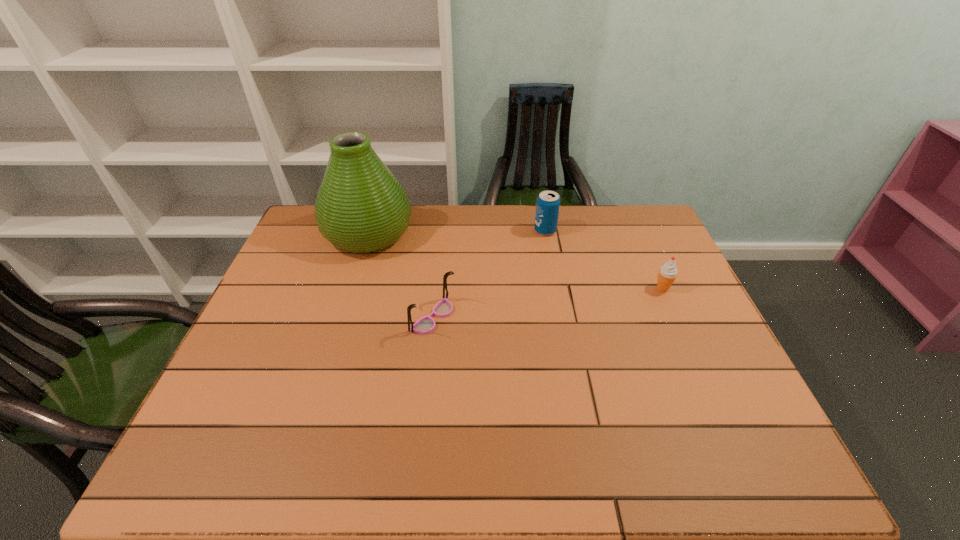
Locate an element on the screen. empty location between the tallest object and the soda can is located at coordinates (457, 232).

Where is `free space between the spectacles and the third object from left to right`? The width and height of the screenshot is (960, 540). free space between the spectacles and the third object from left to right is located at coordinates (489, 274).

Locate an element on the screen. The width and height of the screenshot is (960, 540). object that is the nearest to the nearest object is located at coordinates (361, 207).

Select which object is the second closest to the rightmost object. Please provide its 2D coordinates. Your answer should be formatted as a tuple, i.e. [(x, y)], where the tuple contains the x and y coordinates of a point satisfying the conditions above.

[(425, 325)]

Find the location of a particular element. vacant space that satisfies the following two spatial constraints: 1. on the front side of the leftmost object; 2. on the left side of the rightmost object is located at coordinates (351, 288).

Where is `free spot that satisfies the following two spatial constraints: 1. on the back side of the nearest object; 2. on the left side of the icecream`? free spot that satisfies the following two spatial constraints: 1. on the back side of the nearest object; 2. on the left side of the icecream is located at coordinates (436, 288).

You are a GUI agent. You are given a task and a screenshot of the screen. Output one action in this format:
    pyautogui.click(x=<x>, y=<y>)
    Task: Click on the vacant space that satisfies the following two spatial constraints: 1. on the front side of the rightmost object; 2. on the left side of the tallest object
    This screenshot has width=960, height=540.
    Given the screenshot: What is the action you would take?
    pyautogui.click(x=351, y=288)

The width and height of the screenshot is (960, 540). Identify the location of free space in the image that satisfies the following two spatial constraints: 1. on the front side of the third object from right to left; 2. on the right side of the vase. pyautogui.click(x=342, y=318).